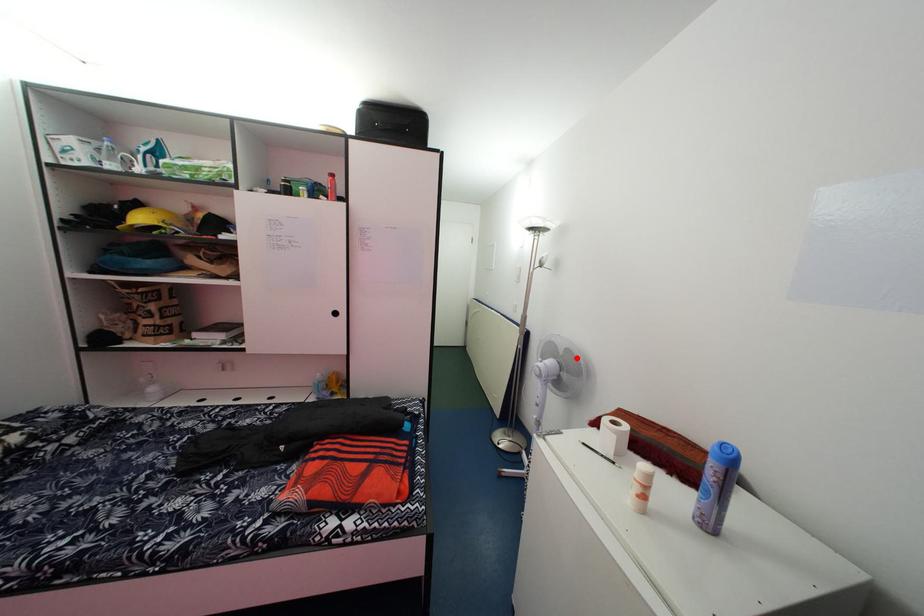
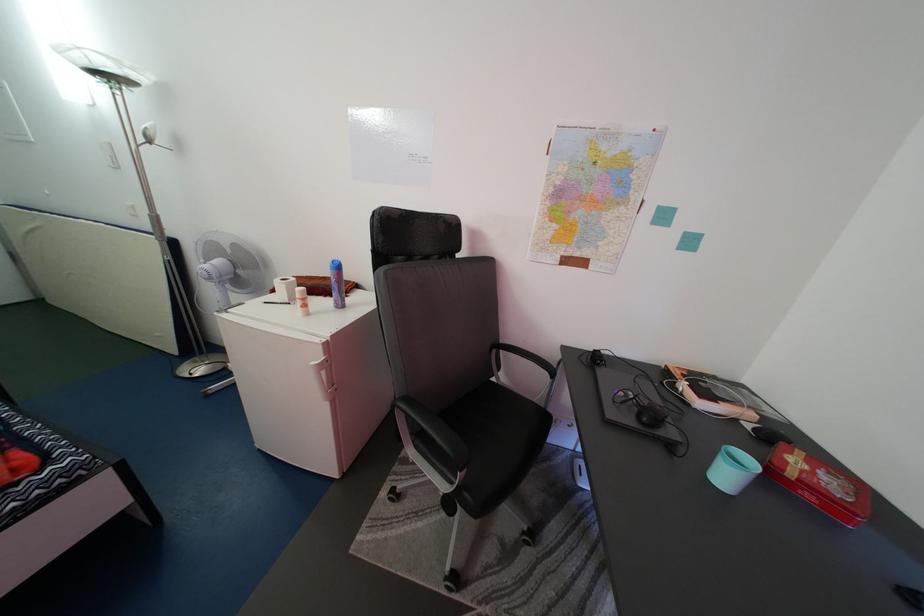
The point at the highlighted location is marked in the first image. Where is the corresponding point in the second image?

(244, 253)